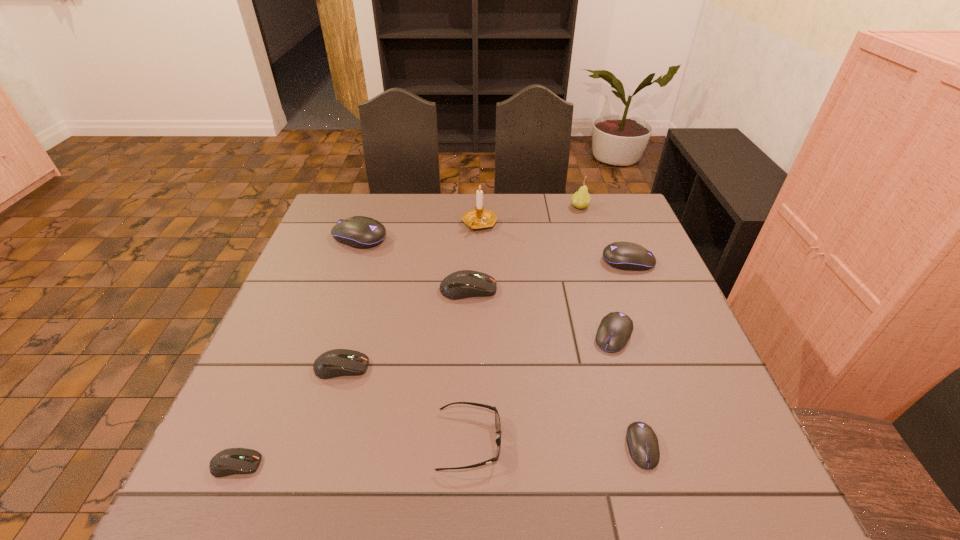
Where is `the second dark computer equipment from left to right`? the second dark computer equipment from left to right is located at coordinates (334, 363).

The image size is (960, 540). Find the location of `the second smallest dark computer equipment`. the second smallest dark computer equipment is located at coordinates (334, 363).

Locate an element on the screen. The height and width of the screenshot is (540, 960). the third biggest black computer mouse is located at coordinates (615, 329).

Identify the location of the fourth nearest computer mouse. (615, 329).

Locate an element on the screen. The width and height of the screenshot is (960, 540). sunglasses is located at coordinates (497, 419).

This screenshot has width=960, height=540. In order to click on the nearest dark computer equipment in this screenshot , I will do `click(230, 461)`.

In order to click on the smallest dark computer equipment in this screenshot , I will do `click(230, 461)`.

You are a GUI agent. You are given a task and a screenshot of the screen. Output one action in this format:
    pyautogui.click(x=<x>, y=<y>)
    Task: Click on the nearest black computer mouse
    Image resolution: width=960 pixels, height=540 pixels.
    Given the screenshot: What is the action you would take?
    pyautogui.click(x=643, y=445)

Find the location of a particular element. The height and width of the screenshot is (540, 960). free point located 0.100m on the left of the gold candle holder is located at coordinates (429, 224).

I want to click on vacant space located 0.160m on the front of the green pear, so click(x=590, y=241).